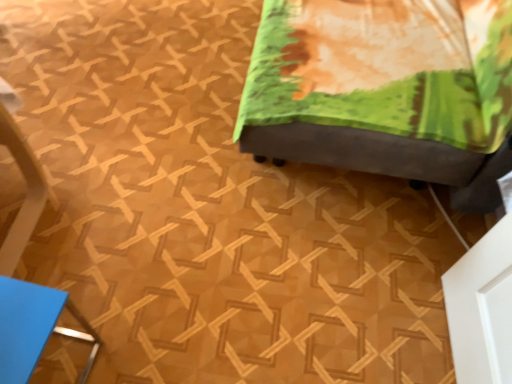
Question: Is blue matte folder at lower left, positioned as the 2th furniture in right-to-left order, surrounding velvet green ottoman at center, which appears as the second furniture when viewed from the left?

Choices:
 (A) yes
 (B) no

Answer: (B)

Question: Considering the relative sizes of blue matte folder at lower left, the 1th furniture when ordered from left to right, and velvet green ottoman at center, placed as the 2th furniture when sorted from bottom to top, in the image provided, is blue matte folder at lower left, the 1th furniture when ordered from left to right, wider than velvet green ottoman at center, placed as the 2th furniture when sorted from bottom to top,?

Choices:
 (A) no
 (B) yes

Answer: (A)

Question: Can you confirm if blue matte folder at lower left, the 1th furniture when ordered from left to right, is taller than velvet green ottoman at center, which appears as the first furniture when viewed from the right?

Choices:
 (A) yes
 (B) no

Answer: (B)

Question: Would you say blue matte folder at lower left, positioned as the 2th furniture in right-to-left order, is a long distance from velvet green ottoman at center, the first furniture in the top-to-bottom sequence?

Choices:
 (A) yes
 (B) no

Answer: (B)

Question: From a real-world perspective, does blue matte folder at lower left, the 1th furniture when ordered from left to right, stand above velvet green ottoman at center, placed as the 2th furniture when sorted from bottom to top?

Choices:
 (A) yes
 (B) no

Answer: (B)

Question: Is blue matte folder at lower left, positioned as the 2th furniture in right-to-left order, not within velvet green ottoman at center, which appears as the second furniture when viewed from the left?

Choices:
 (A) no
 (B) yes

Answer: (B)

Question: Does velvet green ottoman at center, which appears as the first furniture when viewed from the right, come in front of blue matte folder at lower left, the 1th furniture when ordered from left to right?

Choices:
 (A) yes
 (B) no

Answer: (B)

Question: Can you confirm if velvet green ottoman at center, which appears as the first furniture when viewed from the right, is positioned to the left of blue matte folder at lower left, positioned as the 2th furniture in right-to-left order?

Choices:
 (A) no
 (B) yes

Answer: (A)

Question: Is velvet green ottoman at center, which appears as the second furniture when viewed from the left, wider than blue matte folder at lower left, the 2th furniture in the top-to-bottom sequence?

Choices:
 (A) yes
 (B) no

Answer: (A)

Question: Could you tell me if velvet green ottoman at center, which appears as the first furniture when viewed from the right, is turned towards blue matte folder at lower left, marked as the first furniture in a bottom-to-top arrangement?

Choices:
 (A) yes
 (B) no

Answer: (B)

Question: Would you say velvet green ottoman at center, which appears as the first furniture when viewed from the right, is outside blue matte folder at lower left, positioned as the 2th furniture in right-to-left order?

Choices:
 (A) no
 (B) yes

Answer: (B)

Question: Is the surface of velvet green ottoman at center, which appears as the first furniture when viewed from the right, in direct contact with blue matte folder at lower left, marked as the first furniture in a bottom-to-top arrangement?

Choices:
 (A) no
 (B) yes

Answer: (A)

Question: In terms of width, does velvet green ottoman at center, which appears as the second furniture when viewed from the left, look wider or thinner when compared to blue matte folder at lower left, the 1th furniture when ordered from left to right?

Choices:
 (A) thin
 (B) wide

Answer: (B)